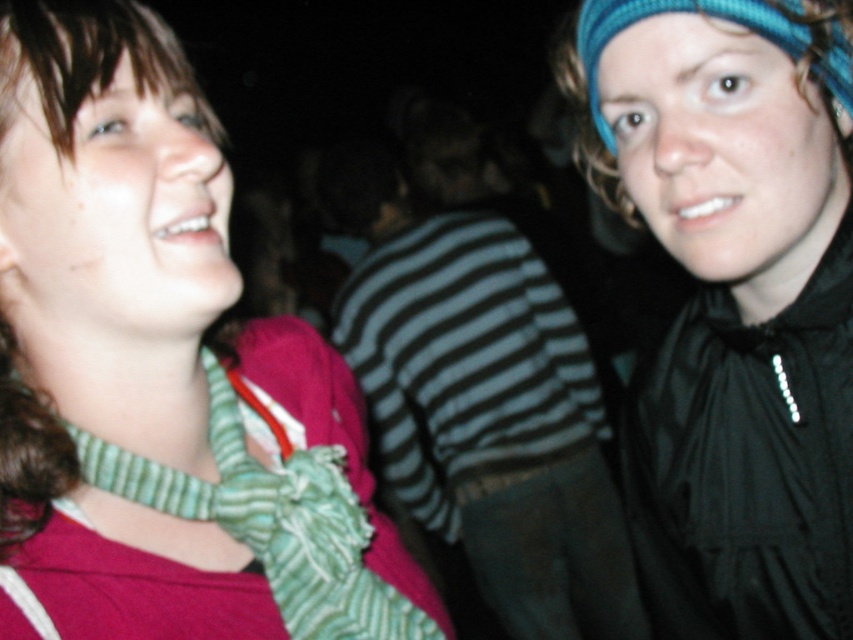
You are at a party and want to find the green striped scarf at left and the blue knitted headscarf at upper right. Which one is closer to the left side of the image?

The green striped scarf at left is closer to the left side of the image because it is positioned to the left of the blue knitted headscarf at upper right.

You are trying to decide which item to pack for a trip. You have the striped fabric shirt at center and the green striped scarf at left. Based on their sizes, which one should you choose if you want something wider?

The striped fabric shirt at center might be wider than green striped scarf at left, so you should choose the striped fabric shirt at center if you want something wider.

You are trying to locate the green striped scarf at left in the image. According to the coordinates provided, where exactly is it positioned?

The green striped scarf at left is located at point coordinates of [276,524].